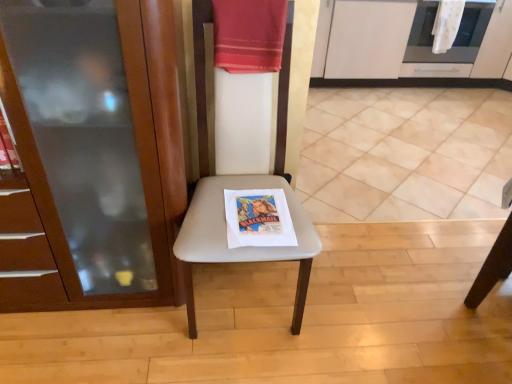
Locate an element on the screen. empty space that is to the right of beige fabric chair at center is located at coordinates (365, 290).